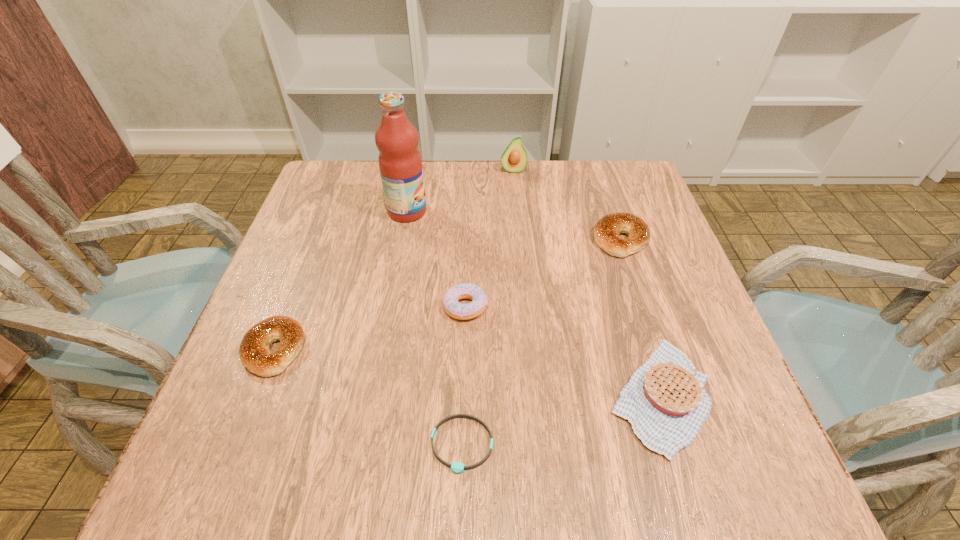
The width and height of the screenshot is (960, 540). I want to click on unoccupied area between the pie and the right bagel, so click(x=640, y=318).

I want to click on free area in between the shortest object and the pie, so click(562, 420).

The image size is (960, 540). What are the coordinates of `free space between the tallest object and the wristband` in the screenshot? It's located at (435, 328).

Identify the location of vacant space that's between the wristband and the nearer bagel. (368, 397).

This screenshot has height=540, width=960. I want to click on vacant space in between the doughnut and the sixth object from right to left, so click(437, 259).

Find the location of `vacant space that is in between the nearer bagel and the tallest object`. vacant space that is in between the nearer bagel and the tallest object is located at coordinates (341, 280).

This screenshot has width=960, height=540. What are the coordinates of `vacant area between the shortest object and the farthest object` in the screenshot? It's located at (488, 307).

At what (x,y) coordinates should I click in order to perform the action: click on vacant area between the shortest object and the left bagel. Please return your answer as a coordinate pair (x, y). The image size is (960, 540). Looking at the image, I should click on (368, 397).

This screenshot has width=960, height=540. Find the location of `blank region between the sixth object from right to left and the pie`. blank region between the sixth object from right to left and the pie is located at coordinates (534, 303).

Locate an element on the screen. The height and width of the screenshot is (540, 960). object that stands as the second closest to the doughnut is located at coordinates (665, 401).